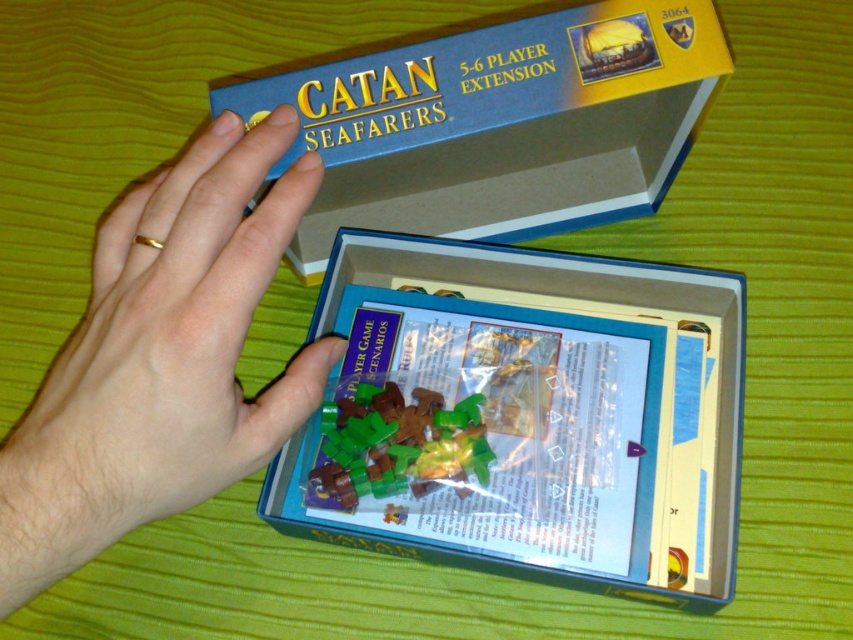
Question: Which of the following is the farthest from the observer?

Choices:
 (A) green plastic pieces at center
 (B) gold metallic ring at upper left

Answer: (A)

Question: Is blue cardboard box at upper center smaller than gold metallic ring at upper left?

Choices:
 (A) yes
 (B) no

Answer: (B)

Question: Does blue cardboard box at upper center come behind green plastic pieces at center?

Choices:
 (A) no
 (B) yes

Answer: (A)

Question: Observing the image, what is the correct spatial positioning of translucent plastic bag at center in reference to gold metallic ring at upper left?

Choices:
 (A) above
 (B) below

Answer: (B)

Question: Among these points, which one is nearest to the camera?

Choices:
 (A) pos(434,147)
 (B) pos(213,429)
 (C) pos(596,385)
 (D) pos(363,384)

Answer: (B)

Question: Which point is farther from the camera taking this photo?

Choices:
 (A) (473, 436)
 (B) (701, 412)
 (C) (189, 355)

Answer: (B)